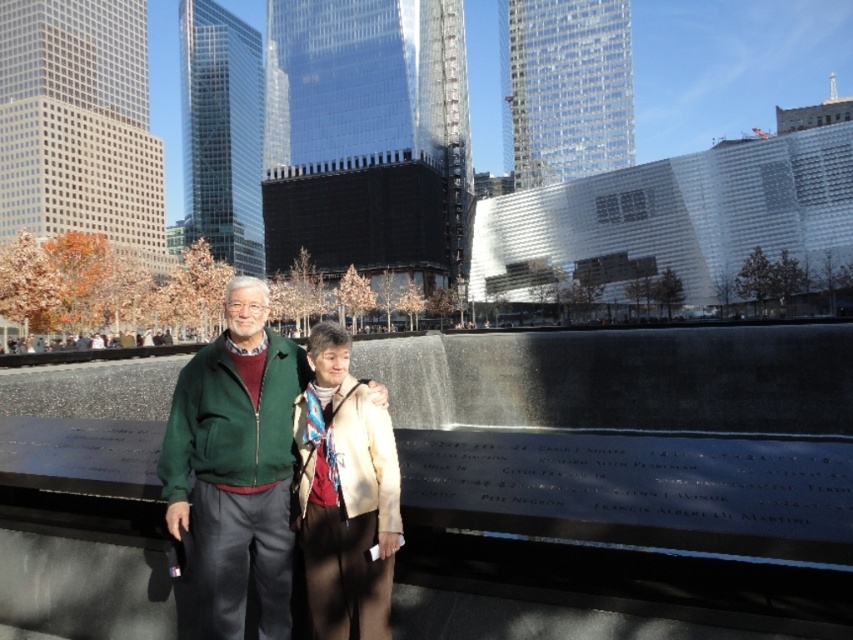
You are a photographer at the memorial site. You notice two jackets hanging on a rack in the foreground. The green fleece jacket at center and the beige textured jacket at center. Which jacket is covering part of the other?

The green fleece jacket at center is positioned over the beige textured jacket at center, so it is covering part of the beige textured jacket at center.

You are taking a photo of the memorial site and want to place two markers at the positions of point [167,484] and point [323,531]. Which marker should you place closer to the camera to maintain the depth in the photo?

You should place the marker at point [167,484] closer to the camera because it is further to the camera than point [323,531].

Looking at this image, you are a photographer at the memorial site and want to capture both the green fleece jacket at center and the beige textured jacket at center in a single frame. Your camera has a minimum focus distance of 45 centimeters. Will both jackets be in focus?

The green fleece jacket at center and the beige textured jacket at center are 46.72 centimeters apart from each other. Since the distance between them exceeds the camera minimum focus distance of 45 centimeters, both jackets will be in focus.